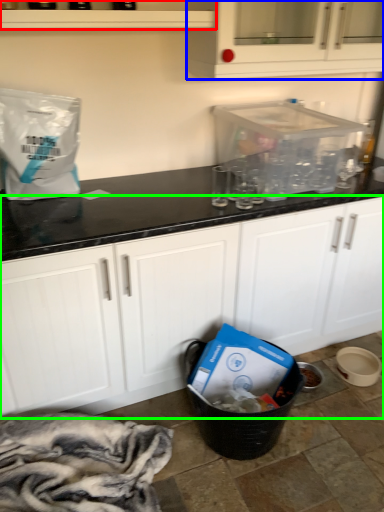
Question: Based on their relative distances, which object is nearer to shelf (highlighted by a red box)? Choose from cabinetry (highlighted by a blue box) and cabinetry (highlighted by a green box).

Choices:
 (A) cabinetry
 (B) cabinetry

Answer: (A)